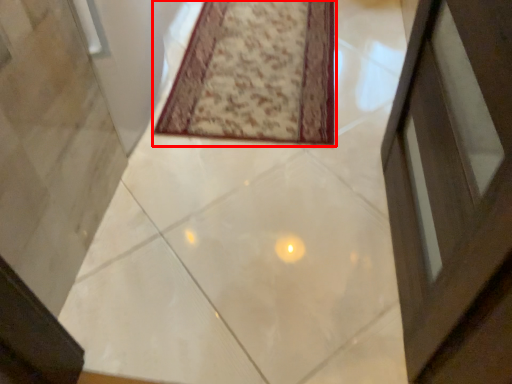
Question: In this image, where is mat (annotated by the red box) located relative to concrete?

Choices:
 (A) right
 (B) left

Answer: (B)